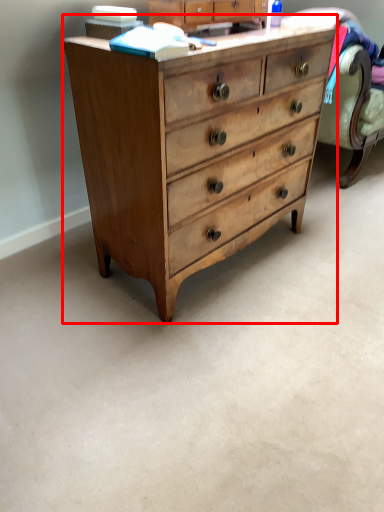
Question: From the image's perspective, what is the correct spatial positioning of chest of drawers (annotated by the red box) in reference to cabinetry?

Choices:
 (A) above
 (B) below

Answer: (B)